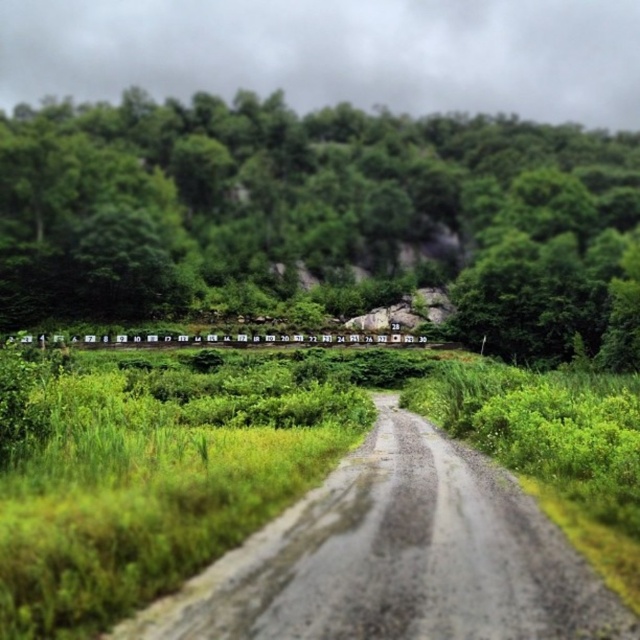
Looking at this image, you are standing at the starting point of the gravel path in the rural landscape. You see two points marked as point (100, 202) and point (432, 548). Which point is closer to your current position?

Point (100, 202) is further to the camera than point (432, 548), so the closer point to your current position is point (432, 548).

You are a hiker planning to walk along the gray gravel road at center. There is a green leafy tree at center blocking your path. Can you walk around it without leaving the road?

The green leafy tree at center is larger in size than gray gravel road at center, so the tree might be too big to walk around while staying on the road. Consider taking an alternative route.

You are a hiker planning to walk along the gray gravel road at center. You want to know if you can reach the green leafy tree at center from the road without leaving the path. Can you do that?

The green leafy tree at center is 158.98 meters away from the gray gravel road at center. Since the tree is located at the center and the road is also at the center, you can reach the green leafy tree at center by walking along the gray gravel road at center.